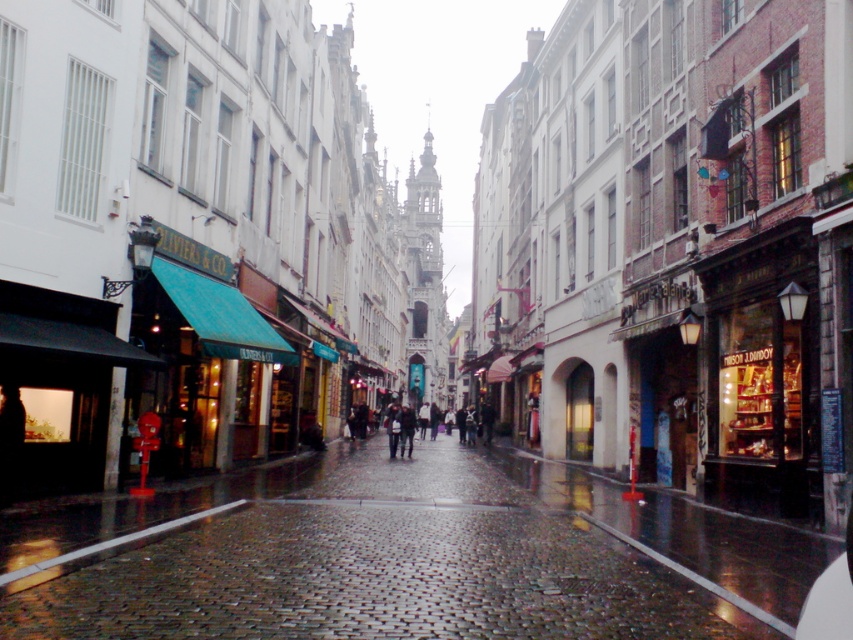
You are a delivery person carrying a large package that is 1.2 meters tall. You need to walk along the narrow cobblestone street. Considering the dark gray coat at center and the cobblestone pavement at center, which object might pose a height restriction for your package?

The dark gray coat at center is taller than the cobblestone pavement at center, so the dark gray coat at center might pose a height restriction for the package since it is taller than the pavement.

You are a delivery person carrying a dark gray coat at center and need to walk along the cobblestone pavement at center. Can you walk comfortably on the pavement without stepping off it?

The cobblestone pavement at center is wider than the dark gray coat at center, so yes, you can walk comfortably on the pavement without stepping off it.

You are standing on the cobblestone pavement at center and want to move to the dark gray coat at center. Which direction should you move to reach it?

The cobblestone pavement at center is positioned on the right side of dark gray coat at center, so you should move to the left to reach it.